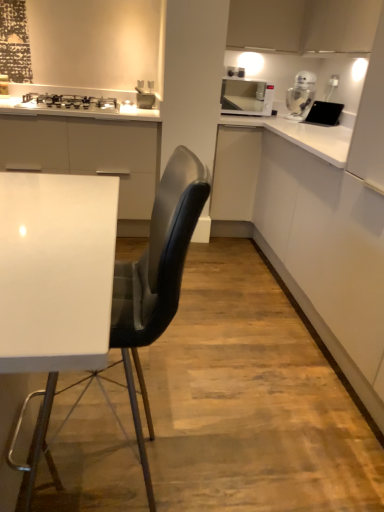
Identify the location of vacant space to the right of black leather chair at center. (243, 455).